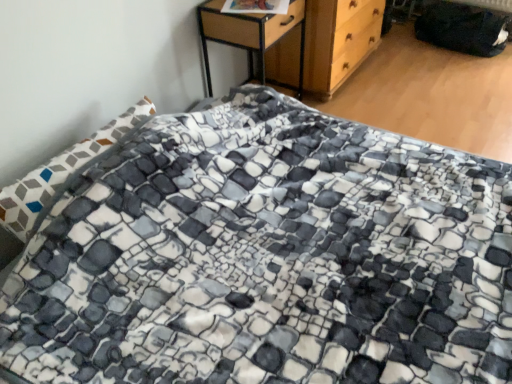
Where is `wooden chest of drawers at upper center`? Image resolution: width=512 pixels, height=384 pixels. wooden chest of drawers at upper center is located at coordinates (326, 45).

Image resolution: width=512 pixels, height=384 pixels. What do you see at coordinates (326, 45) in the screenshot? I see `wooden chest of drawers at upper center` at bounding box center [326, 45].

At what (x,y) coordinates should I click in order to perform the action: click on woodenmaterial/texturenightstand at upper center. Please return your answer as a coordinate pair (x, y). This screenshot has width=512, height=384. Looking at the image, I should click on (249, 35).

What is the approximate height of woodenmaterial/texturenightstand at upper center?

woodenmaterial/texturenightstand at upper center is 62.39 centimeters tall.

This screenshot has height=384, width=512. Describe the element at coordinates (249, 35) in the screenshot. I see `woodenmaterial/texturenightstand at upper center` at that location.

At what (x,y) coordinates should I click in order to perform the action: click on wooden chest of drawers at upper center. Please return your answer as a coordinate pair (x, y). Looking at the image, I should click on (x=326, y=45).

Is woodenmaterial/texturenightstand at upper center at the left side of wooden chest of drawers at upper center?

Yes.

Is the position of woodenmaterial/texturenightstand at upper center less distant than that of wooden chest of drawers at upper center?

Yes, it is in front of wooden chest of drawers at upper center.

Is point (236, 29) closer or farther from the camera than point (335, 34)?

Point (236, 29) is positioned closer to the camera compared to point (335, 34).

From the image's perspective, who appears lower, woodenmaterial/texturenightstand at upper center or wooden chest of drawers at upper center?

From the image's view, woodenmaterial/texturenightstand at upper center is below.

From a real-world perspective, is woodenmaterial/texturenightstand at upper center located beneath wooden chest of drawers at upper center?

No.

Looking at their sizes, would you say woodenmaterial/texturenightstand at upper center is wider or thinner than wooden chest of drawers at upper center?

Clearly, woodenmaterial/texturenightstand at upper center has less width compared to wooden chest of drawers at upper center.

Who is taller, woodenmaterial/texturenightstand at upper center or wooden chest of drawers at upper center?

With more height is woodenmaterial/texturenightstand at upper center.

Who is smaller, woodenmaterial/texturenightstand at upper center or wooden chest of drawers at upper center?

Smaller between the two is woodenmaterial/texturenightstand at upper center.

From the picture: Is woodenmaterial/texturenightstand at upper center inside the boundaries of wooden chest of drawers at upper center, or outside?

The correct answer is: outside.

Is woodenmaterial/texturenightstand at upper center far away from wooden chest of drawers at upper center?

They are positioned close to each other.

Is woodenmaterial/texturenightstand at upper center oriented towards wooden chest of drawers at upper center?

No, woodenmaterial/texturenightstand at upper center is not turned towards wooden chest of drawers at upper center.

How much distance is there between woodenmaterial/texturenightstand at upper center and wooden chest of drawers at upper center?

They are 9.24 inches apart.

Where is `nightstand located below the wooden chest of drawers at upper center (from the image's perspective)`? The width and height of the screenshot is (512, 384). nightstand located below the wooden chest of drawers at upper center (from the image's perspective) is located at coordinates (249, 35).

Is wooden chest of drawers at upper center at the left side of woodenmaterial/texturenightstand at upper center?

In fact, wooden chest of drawers at upper center is to the right of woodenmaterial/texturenightstand at upper center.

Which object is further away from the camera, wooden chest of drawers at upper center or woodenmaterial/texturenightstand at upper center?

wooden chest of drawers at upper center is behind.

Is point (315, 69) positioned behind point (259, 61)?

No, (315, 69) is in front of (259, 61).

From the image's perspective, is wooden chest of drawers at upper center positioned above or below woodenmaterial/texturenightstand at upper center?

From the image's perspective, wooden chest of drawers at upper center appears above woodenmaterial/texturenightstand at upper center.

Consider the image. From a real-world perspective, is wooden chest of drawers at upper center over woodenmaterial/texturenightstand at upper center?

Incorrect, from a real-world perspective, wooden chest of drawers at upper center is lower than woodenmaterial/texturenightstand at upper center.

Which of these two, wooden chest of drawers at upper center or woodenmaterial/texturenightstand at upper center, is wider?

wooden chest of drawers at upper center is wider.

Considering the sizes of wooden chest of drawers at upper center and woodenmaterial/texturenightstand at upper center in the image, is wooden chest of drawers at upper center taller or shorter than woodenmaterial/texturenightstand at upper center?

Clearly, wooden chest of drawers at upper center is shorter compared to woodenmaterial/texturenightstand at upper center.

Based on the photo, between wooden chest of drawers at upper center and woodenmaterial/texturenightstand at upper center, which one has smaller size?

Smaller between the two is woodenmaterial/texturenightstand at upper center.

Is wooden chest of drawers at upper center situated inside woodenmaterial/texturenightstand at upper center or outside?

wooden chest of drawers at upper center is not inside woodenmaterial/texturenightstand at upper center, it's outside.

Is wooden chest of drawers at upper center in contact with woodenmaterial/texturenightstand at upper center?

No, wooden chest of drawers at upper center is not with woodenmaterial/texturenightstand at upper center.

Is wooden chest of drawers at upper center oriented away from woodenmaterial/texturenightstand at upper center?

No.

How different are the orientations of wooden chest of drawers at upper center and woodenmaterial/texturenightstand at upper center in degrees?

wooden chest of drawers at upper center and woodenmaterial/texturenightstand at upper center are facing 0.000235 degrees away from each other.

Measure the distance between wooden chest of drawers at upper center and woodenmaterial/texturenightstand at upper center.

wooden chest of drawers at upper center and woodenmaterial/texturenightstand at upper center are 9.24 inches apart from each other.

The width and height of the screenshot is (512, 384). Find the location of `chest of drawers below the woodenmaterial/texturenightstand at upper center (from a real-world perspective)`. chest of drawers below the woodenmaterial/texturenightstand at upper center (from a real-world perspective) is located at coordinates (326, 45).

What are the coordinates of `chest of drawers below the woodenmaterial/texturenightstand at upper center (from a real-world perspective)` in the screenshot? It's located at (326, 45).

Where is `nightstand in front of the wooden chest of drawers at upper center`? nightstand in front of the wooden chest of drawers at upper center is located at coordinates (249, 35).